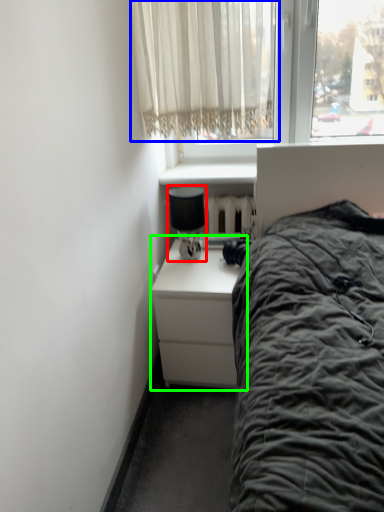
Question: Considering the real-world distances, which object is farthest from lamp (highlighted by a red box)? curtain (highlighted by a blue box) or nightstand (highlighted by a green box)?

Choices:
 (A) curtain
 (B) nightstand

Answer: (A)